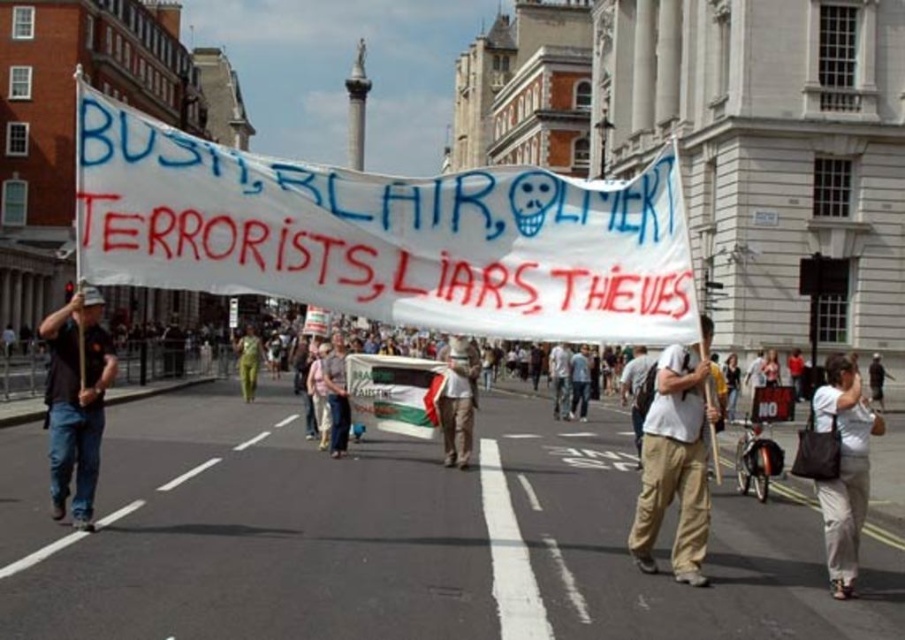
You are a photographer standing at the edge of the protest scene. You want to capture a clear shot of the denim pants at center without the white fabric banner at center blocking it. Is this possible given their positions?

The white fabric banner at center is in front of the denim pants at center, so it would block the view. To capture the denim pants at center clearly, you would need to move around the banner or ask participants to shift positions to ensure the denim pants at center is visible without obstruction.

You are a photographer standing in the middle of the street capturing the protest scene. You want to ensure the white fabric banner at center is sharply focused in your photo. Given that your camera can only focus on objects within a 6 meter range, will the banner be in focus?

The white fabric banner at center is 7.38 meters from camera, which is beyond the camera focus range of 6 meters. Therefore, the banner will not be in focus.